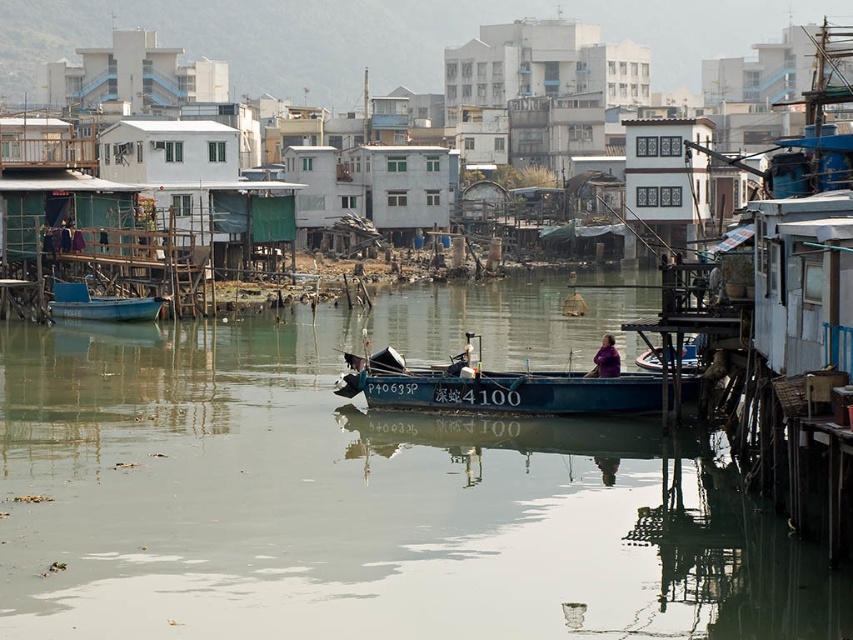
Question: Does blue matte boat at left appear on the right side of purple fabric at center?

Choices:
 (A) yes
 (B) no

Answer: (B)

Question: Among these points, which one is nearest to the camera?

Choices:
 (A) (477, 616)
 (B) (616, 360)
 (C) (450, 388)

Answer: (A)

Question: Can you confirm if blue matte boat at center is smaller than purple fabric at center?

Choices:
 (A) no
 (B) yes

Answer: (B)

Question: Can you confirm if clear water at center is positioned below blue matte boat at left?

Choices:
 (A) no
 (B) yes

Answer: (B)

Question: Among these points, which one is nearest to the camera?

Choices:
 (A) (384, 349)
 (B) (610, 369)
 (C) (227, 568)

Answer: (C)

Question: Which object is farther from the camera taking this photo?

Choices:
 (A) blue matte boat at left
 (B) purple fabric at center

Answer: (A)